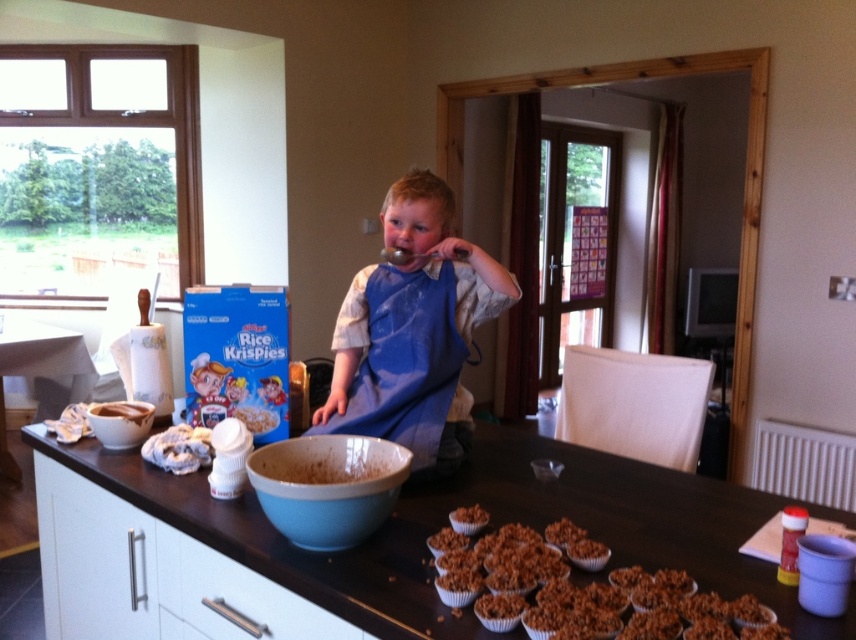
Question: Can you confirm if blue fabric apron at center is positioned below matte white bowl at counter center?

Choices:
 (A) yes
 (B) no

Answer: (B)

Question: Which point is closer to the camera taking this photo?

Choices:
 (A) (459, 508)
 (B) (125, 417)

Answer: (A)

Question: Considering the real-world distances, which object is closest to the blue fabric apron at center?

Choices:
 (A) blue ceramic bowl at center
 (B) crispy brown muffin at lower center
 (C) crispy brown cereal at center
 (D) matte white bowl at counter center

Answer: (A)

Question: Estimate the real-world distances between objects in this image. Which object is closer to the blue ceramic bowl at center?

Choices:
 (A) brown matte table at center
 (B) crispy brown muffin at lower center
 (C) matte white bowl at counter center

Answer: (A)

Question: Is the position of brown matte table at center more distant than that of blue fabric apron at center?

Choices:
 (A) no
 (B) yes

Answer: (A)

Question: Does blue ceramic bowl at center appear on the right side of matte white bowl at counter center?

Choices:
 (A) yes
 (B) no

Answer: (A)